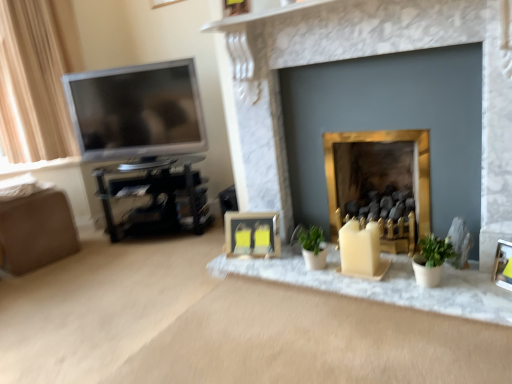
Question: From the image's perspective, is satin silver television at left positioned above or below black plastic entertainment center at left?

Choices:
 (A) below
 (B) above

Answer: (B)

Question: From a real-world perspective, is satin silver television at left physically located above or below black plastic entertainment center at left?

Choices:
 (A) above
 (B) below

Answer: (A)

Question: Estimate the real-world distances between objects in this image. Which object is closer to the black plastic entertainment center at left?

Choices:
 (A) matte yellow candle at center, placed as the first candle when sorted from left to right
 (B) matte black picture frame at center, placed as the 2th picture frame when sorted from front to back
 (C) beige matte candle at center, the 1th candle positioned from the right
 (D) gold metallic fireplace at center, the 2th fireplace positioned from the left
 (E) marble fireplace at center, which is counted as the second fireplace, starting from the right

Answer: (B)

Question: Which of these objects is positioned farthest from the metallic gold picture frame at lower right, arranged as the 2th picture frame when viewed from the back?

Choices:
 (A) gold metallic fireplace at center, the 2th fireplace positioned from the left
 (B) matte black picture frame at center, the 1th picture frame from the back
 (C) beige matte candle at center, arranged as the 2th candle when viewed from the left
 (D) marble fireplace at center, the first fireplace from the left
 (E) satin silver television at left

Answer: (E)